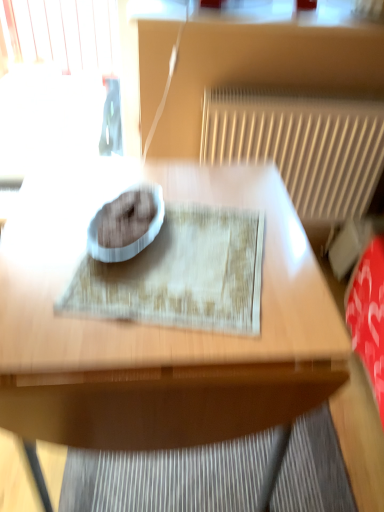
Locate an element on the screen. The height and width of the screenshot is (512, 384). free location above wooden table at center (from a real-world perspective) is located at coordinates (155, 237).